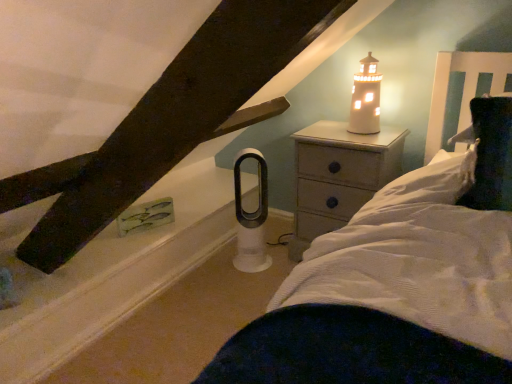
Question: Looking at their shapes, would you say wooden nightstand at upper right is wider or thinner than white ceramic lighthouse at upper right?

Choices:
 (A) wide
 (B) thin

Answer: (A)

Question: Is wooden nightstand at upper right taller or shorter than white ceramic lighthouse at upper right?

Choices:
 (A) short
 (B) tall

Answer: (B)

Question: Estimate the real-world distances between objects in this image. Which object is closer to the wooden nightstand at upper right?

Choices:
 (A) white ceramic lighthouse at upper right
 (B) white matte window sill at lower left

Answer: (A)

Question: Estimate the real-world distances between objects in this image. Which object is farther from the wooden nightstand at upper right?

Choices:
 (A) white matte window sill at lower left
 (B) white ceramic lighthouse at upper right

Answer: (A)